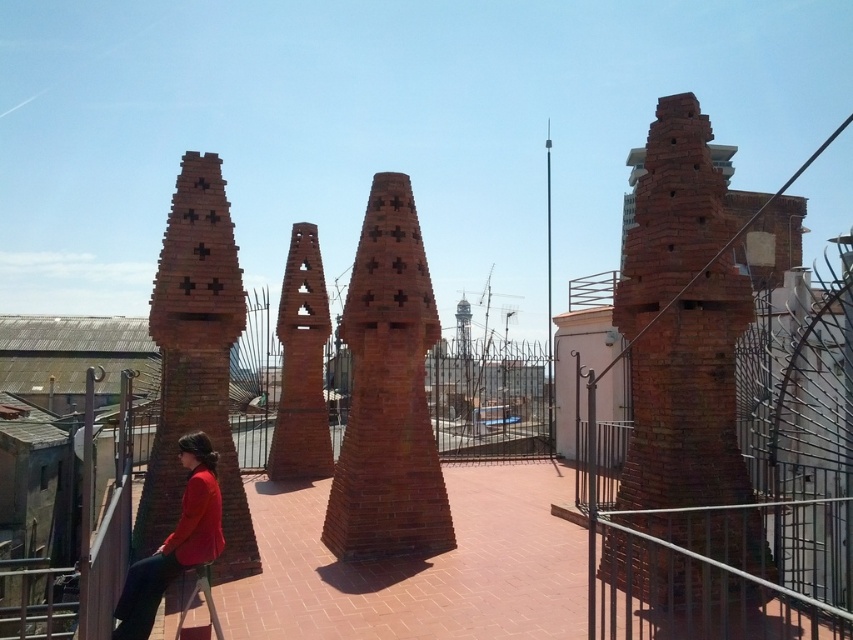
You are standing on the rooftop and want to locate the red brick chimney at left. What are the coordinates where you should look?

The coordinates for the red brick chimney at left are at point [196,362].

You are standing on the rooftop and want to place a 2.5 meter long ladder between the red brick chimney at left and the matte red jacket at lower left. Is there enough space to place the ladder horizontally between them?

The distance between the red brick chimney at left and the matte red jacket at lower left is 1.98 meters, which is shorter than the ladder length of 2.5 meters. Therefore, the ladder cannot be placed horizontally between them.

You are a maintenance worker on the rooftop and need to place a 2 meter wide equipment between the red brick chimney at right and the red brick chimney at left. Can the equipment fit between them based on their widths?

The red brick chimney at right is wider than the red brick chimney at left. However, the exact widths are not provided, so it is impossible to determine if the 2 meter wide equipment can fit between them based solely on their relative widths.